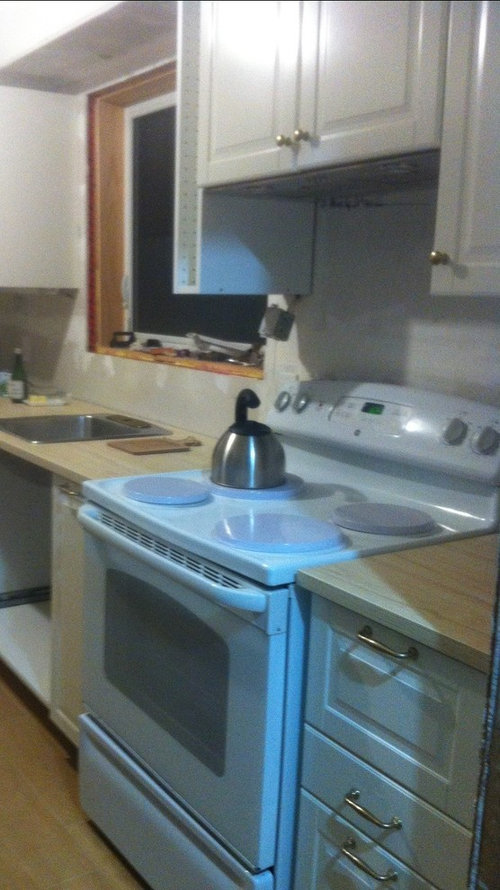
The height and width of the screenshot is (890, 500). In order to click on chopping board in this screenshot , I will do `click(160, 442)`.